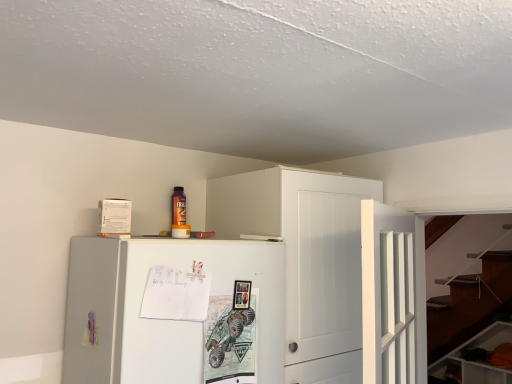
Question: Should I look upward or downward to see white matte cabinet at upper center, which is counted as the 2th cabinetry, starting from the bottom?

Choices:
 (A) down
 (B) up

Answer: (A)

Question: Is white glossy cabinet at lower right, the second cabinetry from the front, positioned in front of white matte cabinet at upper center, marked as the 2th cabinetry in a back-to-front arrangement?

Choices:
 (A) yes
 (B) no

Answer: (B)

Question: Is white matte cabinet at upper center, the second cabinetry viewed from the right, a part of white glossy cabinet at lower right, the second cabinetry from the front?

Choices:
 (A) yes
 (B) no

Answer: (B)

Question: Considering the relative sizes of white glossy cabinet at lower right, the second cabinetry positioned from the left, and white matte cabinet at upper center, the 1th cabinetry in the left-to-right sequence, in the image provided, is white glossy cabinet at lower right, the second cabinetry positioned from the left, shorter than white matte cabinet at upper center, the 1th cabinetry in the left-to-right sequence,?

Choices:
 (A) yes
 (B) no

Answer: (A)

Question: Are white glossy cabinet at lower right, marked as the first cabinetry in a bottom-to-top arrangement, and white matte cabinet at upper center, the second cabinetry viewed from the right, making contact?

Choices:
 (A) yes
 (B) no

Answer: (B)

Question: From the image's perspective, is white glossy cabinet at lower right, the second cabinetry when ordered from top to bottom, below white matte cabinet at upper center, which is counted as the 2th cabinetry, starting from the bottom?

Choices:
 (A) no
 (B) yes

Answer: (B)

Question: From a real-world perspective, is white glossy cabinet at lower right, marked as the first cabinetry in a right-to-left arrangement, located beneath white matte cabinet at upper center, marked as the 2th cabinetry in a back-to-front arrangement?

Choices:
 (A) no
 (B) yes

Answer: (B)

Question: From a real-world perspective, is white matte cabinet at upper center, the 1th cabinetry when ordered from top to bottom, over white glossy cabinet at lower right, placed as the 1th cabinetry when sorted from back to front?

Choices:
 (A) yes
 (B) no

Answer: (A)

Question: From the image's perspective, is white matte cabinet at upper center, marked as the 2th cabinetry in a back-to-front arrangement, on top of white glossy cabinet at lower right, the second cabinetry positioned from the left?

Choices:
 (A) yes
 (B) no

Answer: (A)

Question: Is white matte cabinet at upper center, the second cabinetry viewed from the right, oriented towards white glossy cabinet at lower right, the second cabinetry from the front?

Choices:
 (A) yes
 (B) no

Answer: (B)

Question: Considering the relative positions of white matte cabinet at upper center, which is counted as the 2th cabinetry, starting from the bottom, and white glossy cabinet at lower right, the second cabinetry from the front, in the image provided, is white matte cabinet at upper center, which is counted as the 2th cabinetry, starting from the bottom, to the left of white glossy cabinet at lower right, the second cabinetry from the front, from the viewer's perspective?

Choices:
 (A) no
 (B) yes

Answer: (B)

Question: Is white matte cabinet at upper center, which is counted as the 2th cabinetry, starting from the bottom, positioned beyond the bounds of white glossy cabinet at lower right, the second cabinetry from the front?

Choices:
 (A) no
 (B) yes

Answer: (B)

Question: Is the position of white matte cabinet at upper center, the 1th cabinetry in the left-to-right sequence, less distant than that of white glossy cabinet at lower right, the second cabinetry positioned from the left?

Choices:
 (A) no
 (B) yes

Answer: (B)

Question: From a real-world perspective, is white matte cabinet at upper center, marked as the 2th cabinetry in a back-to-front arrangement, physically below white matte refrigerator at center?

Choices:
 (A) yes
 (B) no

Answer: (B)